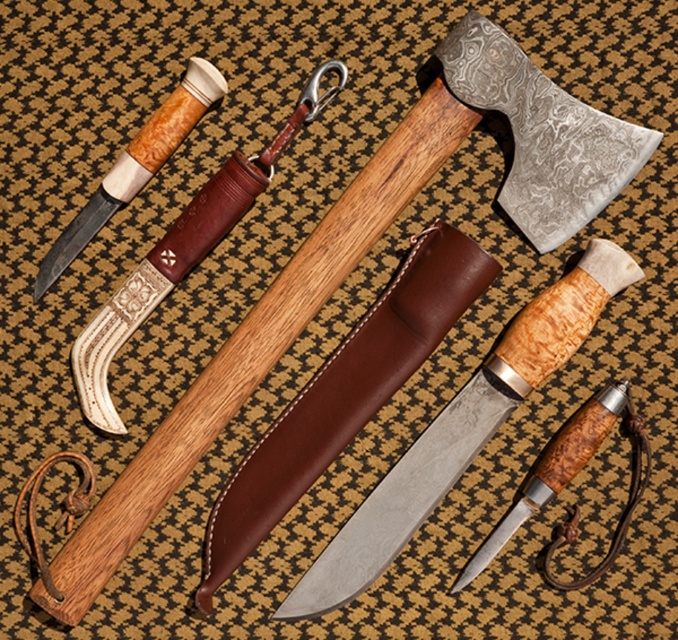
Can you confirm if matte bone-handled dagger at upper left is thinner than matte brown wooden dagger at center?

Incorrect, matte bone-handled dagger at upper left's width is not less than matte brown wooden dagger at center's.

Between matte bone-handled dagger at upper left and matte brown wooden dagger at center, which one has more height?

matte bone-handled dagger at upper left is taller.

Who is more distant from viewer, (39, 292) or (586, 442)?

The point (586, 442) is more distant.

This screenshot has width=678, height=640. I want to click on matte bone-handled dagger at upper left, so [x=136, y=164].

Which of these two, matte silver blade at center or matte silver knife at center, stands shorter?

With less height is matte silver knife at center.

Who is positioned more to the right, matte silver blade at center or matte silver knife at center?

matte silver blade at center is more to the right.

At what (x,y) coordinates should I click in order to perform the action: click on matte silver blade at center. Please return your answer as a coordinate pair (x, y). Image resolution: width=678 pixels, height=640 pixels. Looking at the image, I should click on (460, 429).

Between point (81, 403) and point (201, 99), which one is positioned behind?

Positioned behind is point (81, 403).

Who is higher up, matte white bone-handled knife at upper left or matte bone-handled dagger at upper left?

matte bone-handled dagger at upper left is higher up.

Which is in front, point (129, 284) or point (155, 157)?

Point (155, 157)

The height and width of the screenshot is (640, 678). Identify the location of matte white bone-handled knife at upper left. coord(180,253).